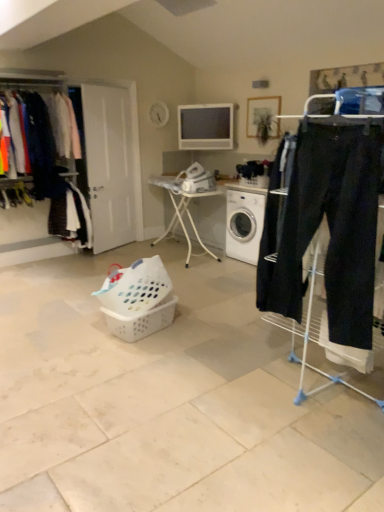
Question: From the image's perspective, is matte black pants at left, the 2th clothing from the bottom, above white plastic basket at center, acting as the first basket starting from the bottom?

Choices:
 (A) no
 (B) yes

Answer: (B)

Question: Does matte black pants at left, the 2th clothing from the bottom, appear on the right side of white plastic basket at center, acting as the first basket starting from the bottom?

Choices:
 (A) yes
 (B) no

Answer: (B)

Question: From the image's perspective, does matte black pants at left, which appears as the first clothing when viewed from the top, appear lower than white plastic basket at center, which is the 2th basket from top to bottom?

Choices:
 (A) yes
 (B) no

Answer: (B)

Question: Is matte black pants at left, the 2th clothing from the bottom, closer to the viewer compared to white plastic basket at center, which is the 2th basket from top to bottom?

Choices:
 (A) no
 (B) yes

Answer: (A)

Question: Is matte black pants at left, the 2th clothing from the bottom, to the left of white plastic basket at center, which is the 2th basket from top to bottom, from the viewer's perspective?

Choices:
 (A) yes
 (B) no

Answer: (A)

Question: From a real-world perspective, relative to matte black pants at left, the 2th clothing from the bottom, is dark blue fabric pants at left, the 2th clothing viewed from the top, vertically above or below?

Choices:
 (A) above
 (B) below

Answer: (B)

Question: Is point (79, 237) closer or farther from the camera than point (33, 97)?

Choices:
 (A) farther
 (B) closer

Answer: (A)

Question: Based on their positions, is dark blue fabric pants at left, marked as the first clothing in a bottom-to-top arrangement, located to the left or right of matte black pants at left, the 2th clothing from the bottom?

Choices:
 (A) right
 (B) left

Answer: (A)

Question: From the image's perspective, relative to matte black pants at left, the 2th clothing from the bottom, is dark blue fabric pants at left, marked as the first clothing in a bottom-to-top arrangement, above or below?

Choices:
 (A) above
 (B) below

Answer: (B)

Question: Is matte black clothes at left inside the boundaries of dark blue fabric pants at left, marked as the first clothing in a bottom-to-top arrangement, or outside?

Choices:
 (A) inside
 (B) outside

Answer: (B)

Question: Is matte black clothes at left wider or thinner than dark blue fabric pants at left, marked as the first clothing in a bottom-to-top arrangement?

Choices:
 (A) wide
 (B) thin

Answer: (B)

Question: Considering the positions of matte black clothes at left and dark blue fabric pants at left, the 2th clothing viewed from the top, in the image, is matte black clothes at left bigger or smaller than dark blue fabric pants at left, the 2th clothing viewed from the top,?

Choices:
 (A) big
 (B) small

Answer: (A)

Question: From the image's perspective, is matte black clothes at left positioned above or below dark blue fabric pants at left, marked as the first clothing in a bottom-to-top arrangement?

Choices:
 (A) above
 (B) below

Answer: (A)

Question: Based on their sizes in the image, would you say matte black pants at left, the 2th clothing from the bottom, is bigger or smaller than dark blue fabric pants at left, the 2th clothing viewed from the top?

Choices:
 (A) big
 (B) small

Answer: (A)

Question: From a real-world perspective, is matte black pants at left, which appears as the first clothing when viewed from the top, physically located above or below dark blue fabric pants at left, the 2th clothing viewed from the top?

Choices:
 (A) below
 (B) above

Answer: (B)